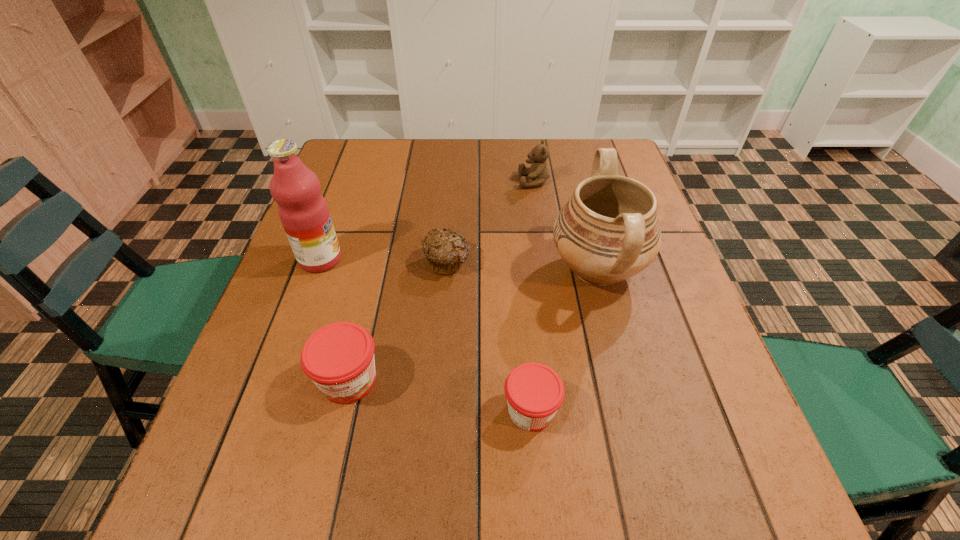
Where is `free space that satisfies the following two spatial constraints: 1. on the label of the tallest object; 2. on the left side of the muffin`? The height and width of the screenshot is (540, 960). free space that satisfies the following two spatial constraints: 1. on the label of the tallest object; 2. on the left side of the muffin is located at coordinates (320, 262).

Find the location of a particular element. The width and height of the screenshot is (960, 540). free region that satisfies the following two spatial constraints: 1. on the front-facing side of the urn; 2. on the label side of the taller jam is located at coordinates (626, 380).